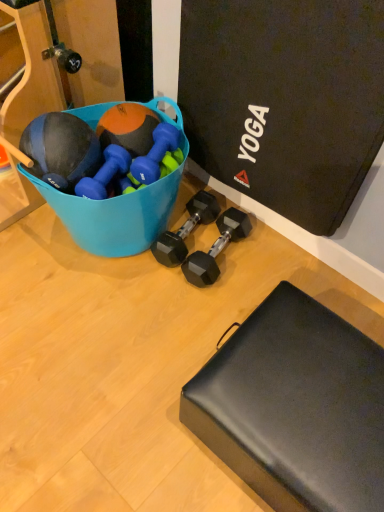
Find the location of a particular element. free space in front of black rubber dumbbell at center, which is the 4th dumbbell in left-to-right order is located at coordinates (213, 302).